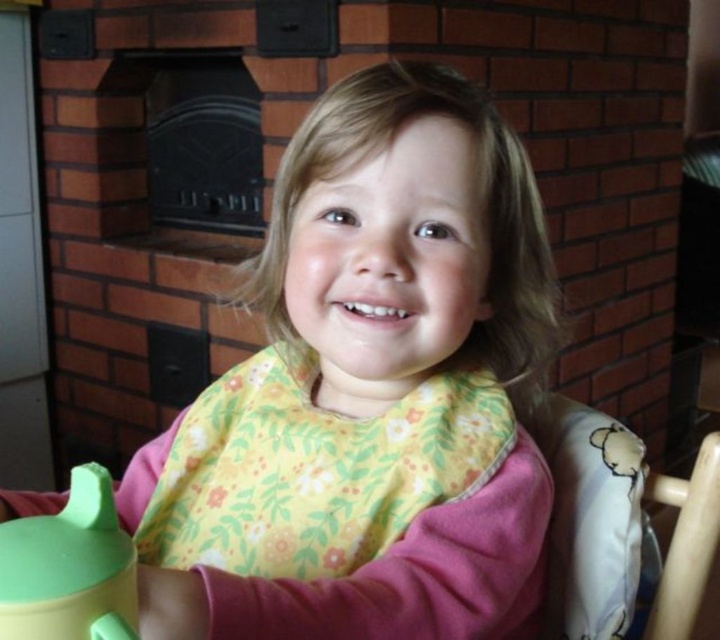
Between wooden chair at right and green rubber tea pot at lower left, which one appears on the left side from the viewer's perspective?

Positioned to the left is green rubber tea pot at lower left.

What do you see at coordinates (624, 531) in the screenshot?
I see `wooden chair at right` at bounding box center [624, 531].

Who is more distant from viewer, (544,445) or (24,573)?

The point (544,445) is behind.

The image size is (720, 640). I want to click on wooden chair at right, so click(624, 531).

Which of these two, pink fabric bib at center or wooden chair at right, stands taller?

pink fabric bib at center

Is pink fabric bib at center to the left of wooden chair at right from the viewer's perspective?

Correct, you'll find pink fabric bib at center to the left of wooden chair at right.

Who is more forward, (386, 460) or (570, 582)?

Point (386, 460) is more forward.

Where is `pink fabric bib at center`? Image resolution: width=720 pixels, height=640 pixels. pink fabric bib at center is located at coordinates (368, 392).

Is pink fabric bib at center further to the viewer compared to green rubber tea pot at lower left?

That is True.

Is pink fabric bib at center taller than green rubber tea pot at lower left?

Yes.

You are a GUI agent. You are given a task and a screenshot of the screen. Output one action in this format:
    pyautogui.click(x=<x>, y=<y>)
    Task: Click on the pink fabric bib at center
    The height and width of the screenshot is (640, 720).
    Given the screenshot: What is the action you would take?
    pyautogui.click(x=368, y=392)